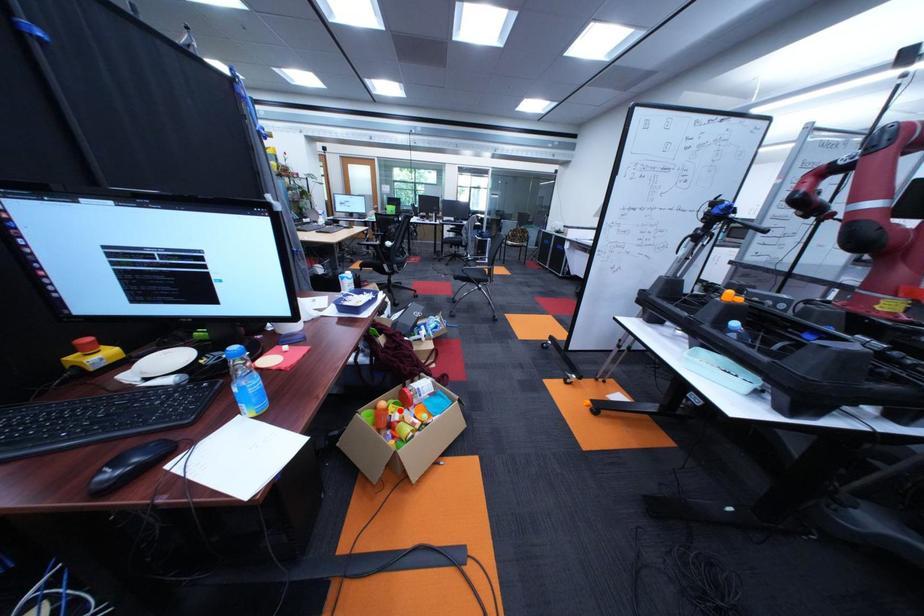
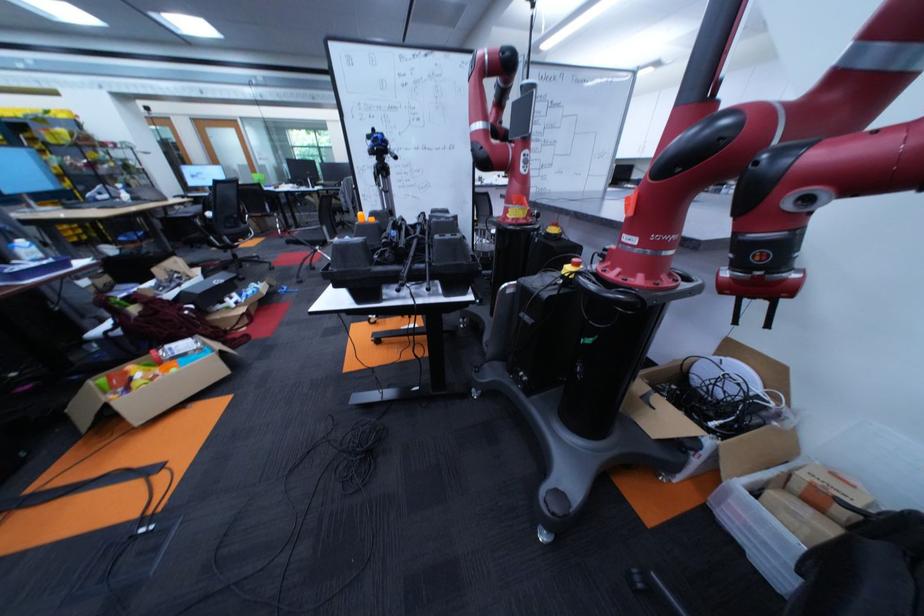
In the second image, find the point that corresponds to the highlighted location in the first image.

(140, 371)